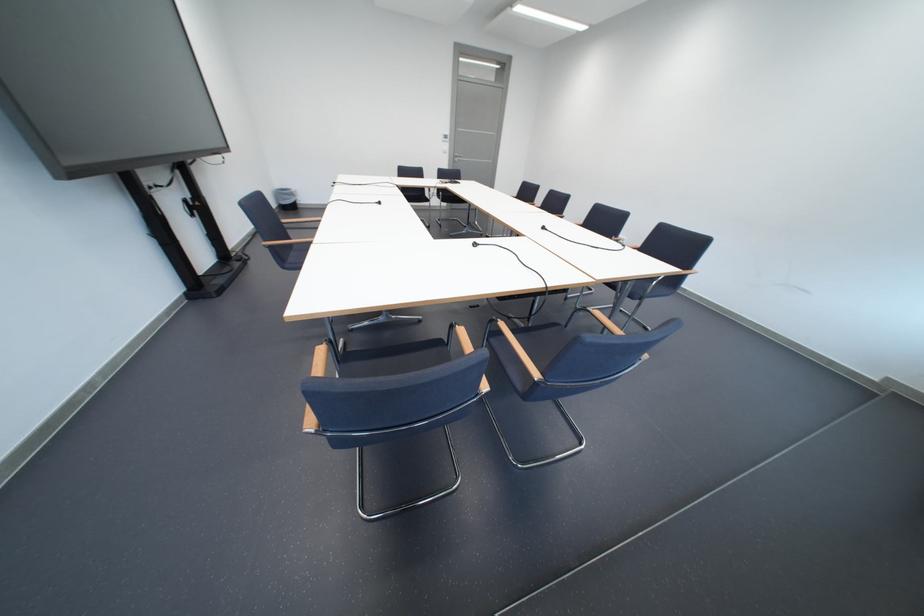
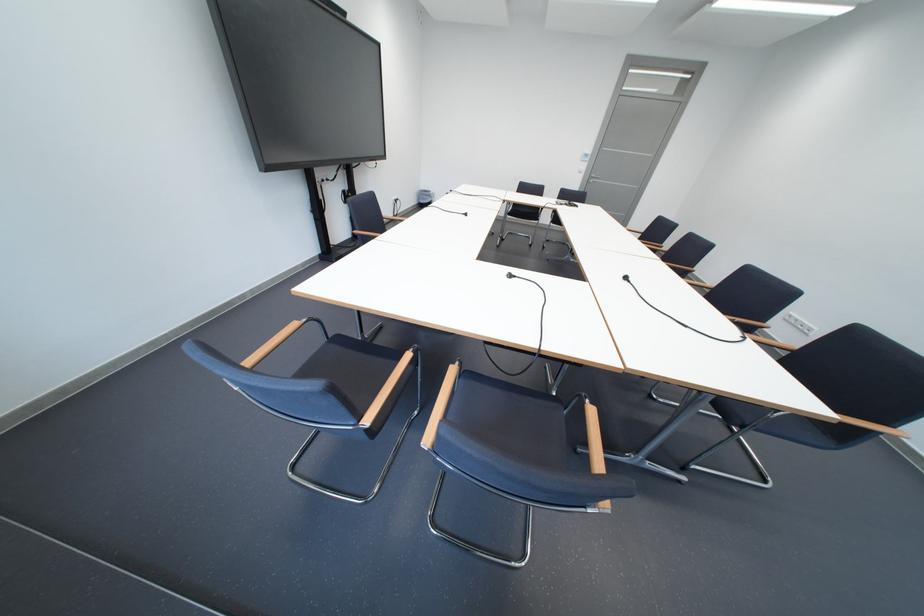
Question: Based on the continuous images, in which direction is the camera rotating? Reply with the corresponding letter.

Choices:
 (A) Left
 (B) Right
 (C) Up
 (D) Down

Answer: (A)